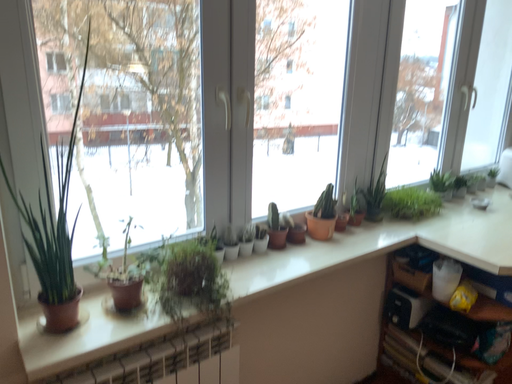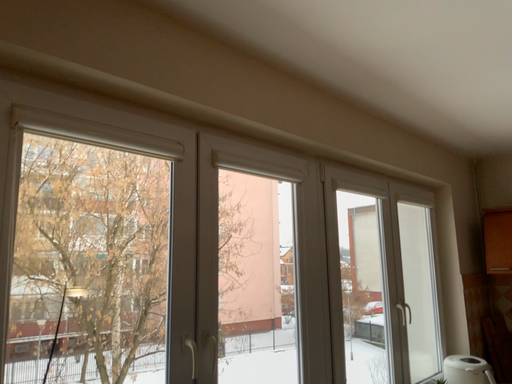
Question: How did the camera likely rotate when shooting the video?

Choices:
 (A) rotated left
 (B) rotated right

Answer: (B)